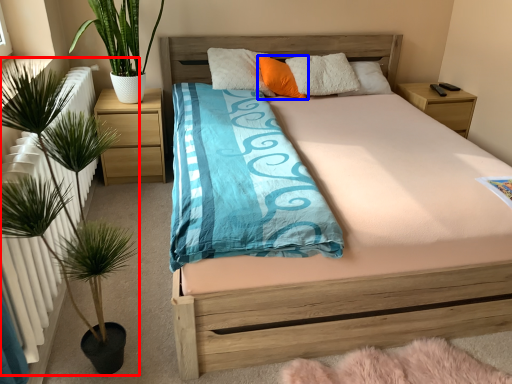
Question: Which of the following is the farthest to the observer, houseplant (highlighted by a red box) or pillow (highlighted by a blue box)?

Choices:
 (A) houseplant
 (B) pillow

Answer: (B)